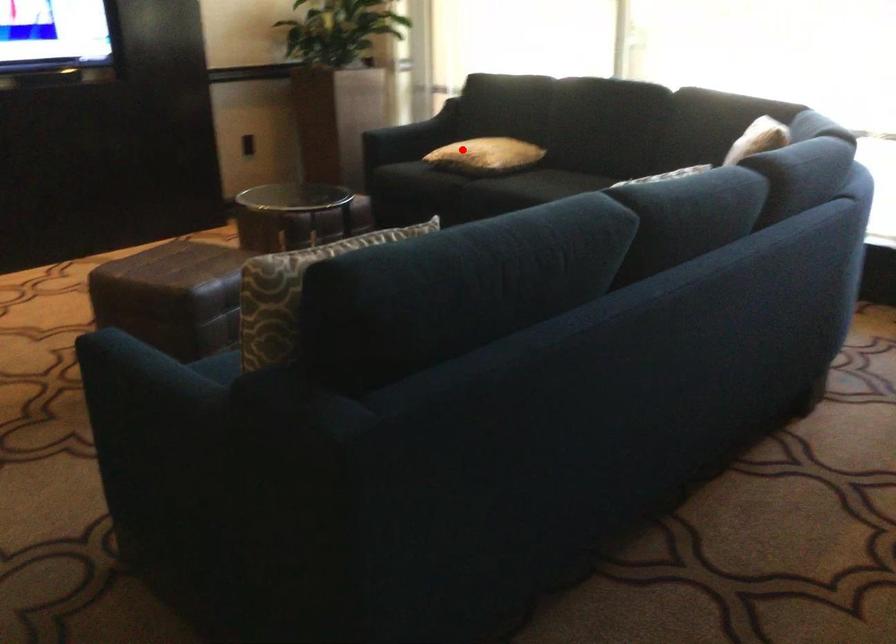
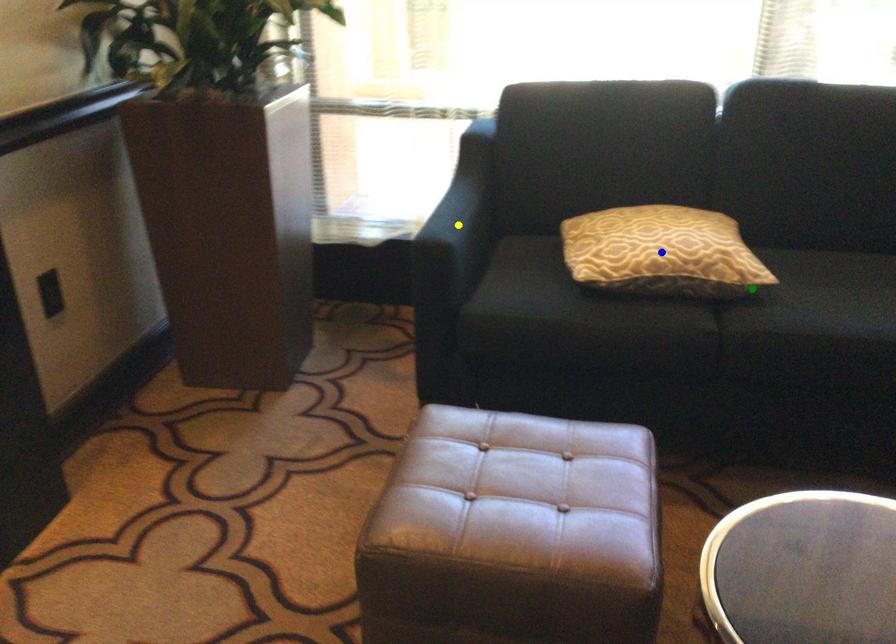
Question: I am providing you with two images of the same scene from different viewpoints. A red point is marked on the first image. You are given multiple points on the second image. In image 2, which mark is for the same physical point as the one in image 1?

Choices:
 (A) green point
 (B) blue point
 (C) yellow point

Answer: (B)